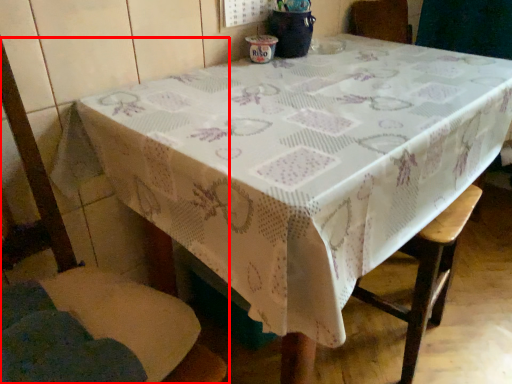
Question: Observing the image, what is the correct spatial positioning of chair (annotated by the red box) in reference to bar stool?

Choices:
 (A) left
 (B) right

Answer: (A)